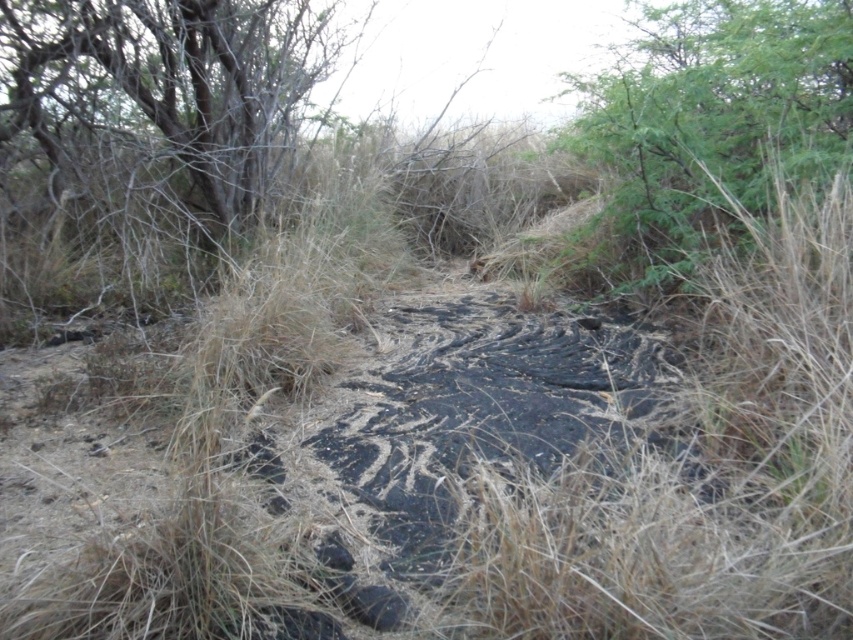
Is the position of green leafy tree at upper right more distant than that of gray bark tree at upper left?

That is False.

Is green leafy tree at upper right below gray bark tree at upper left?

Actually, green leafy tree at upper right is above gray bark tree at upper left.

Find the location of a particular element. The width and height of the screenshot is (853, 640). green leafy tree at upper right is located at coordinates (709, 118).

The image size is (853, 640). I want to click on green leafy tree at upper right, so click(709, 118).